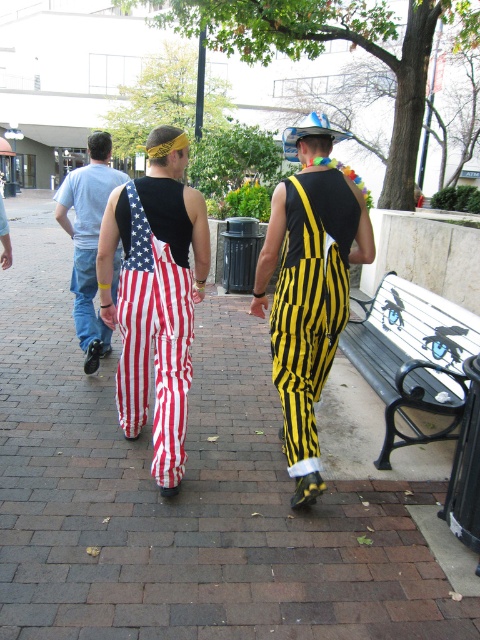
You are standing at the origin point in the image. There is a metallic silver bench at right represented by point (x=411, y=356). Can you walk straight towards the bench without encountering any obstacles?

The metallic silver bench at right is represented by point (x=411, y=356). Since the description does not mention any obstacles between you and the bench, you can walk straight towards it.

You are a photographer standing at the starting point of a parade route. You want to take a photo of the metallic silver bench at right and the american flag pants at left. How far apart are these two objects in the scene?

The metallic silver bench at right is 1.90 meters away from the american flag pants at left.

In the scene shown: You are a photographer trying to capture the entire scene in one shot. The red brick pavement at center and the american flag pants at left are both in your frame. Which object is wider in the image?

The red brick pavement at center is wider than the american flag pants at left.